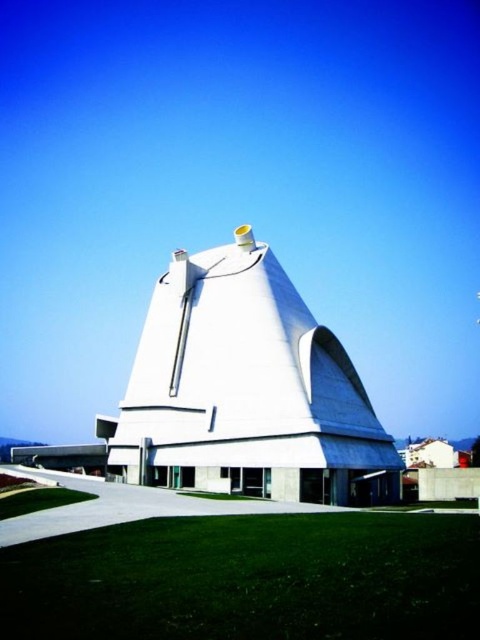
Question: Which point is closer to the camera?

Choices:
 (A) green grass at lower center
 (B) green grass at lower left
 (C) white concrete building at center

Answer: (A)

Question: Can you confirm if green grass at lower center is positioned to the left of green grass at lower left?

Choices:
 (A) no
 (B) yes

Answer: (A)

Question: Which point appears closest to the camera in this image?

Choices:
 (A) (271, 422)
 (B) (372, 557)

Answer: (B)

Question: Which of the following is the closest to the observer?

Choices:
 (A) green grass at lower left
 (B) white concrete building at center
 (C) green grass at lower center

Answer: (C)

Question: Is green grass at lower center closer to the viewer compared to green grass at lower left?

Choices:
 (A) yes
 (B) no

Answer: (A)

Question: In this image, where is green grass at lower center located relative to green grass at lower left?

Choices:
 (A) below
 (B) above

Answer: (B)